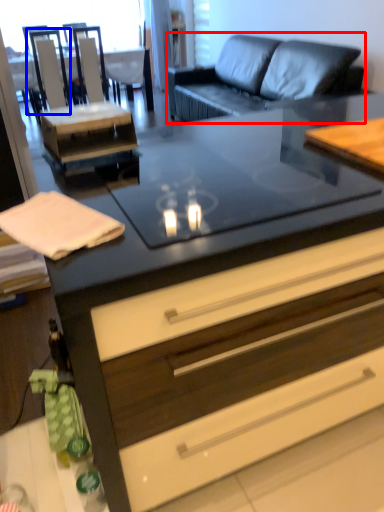
Question: Which point is closer to the camera, studio couch (highlighted by a red box) or armchair (highlighted by a blue box)?

Choices:
 (A) studio couch
 (B) armchair

Answer: (A)